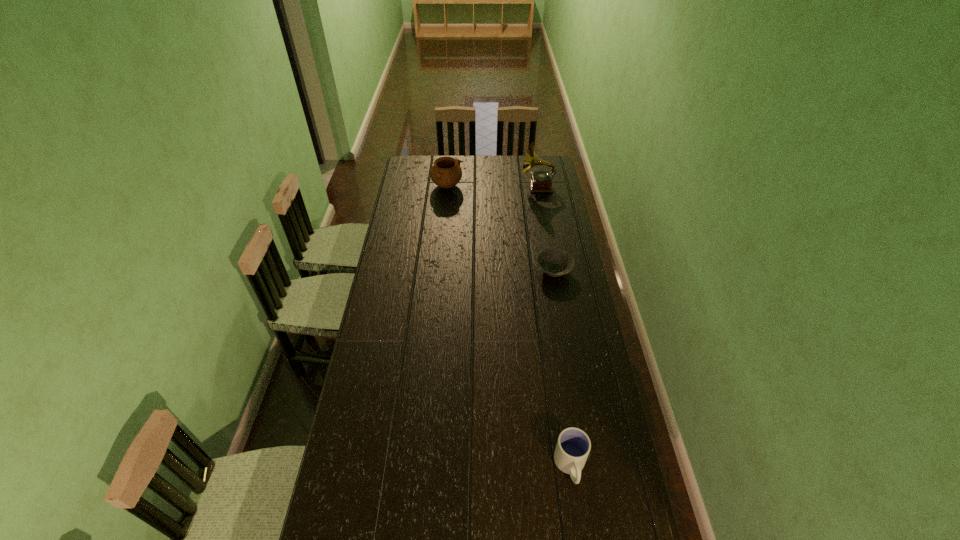
Locate an element on the screen. The width and height of the screenshot is (960, 540). the tallest object is located at coordinates (541, 181).

Locate an element on the screen. The height and width of the screenshot is (540, 960). pottery is located at coordinates pyautogui.click(x=446, y=172).

The width and height of the screenshot is (960, 540). Find the location of `the third shortest object`. the third shortest object is located at coordinates (446, 172).

Image resolution: width=960 pixels, height=540 pixels. I want to click on the nearest object, so click(x=573, y=446).

The image size is (960, 540). I want to click on cup, so click(573, 446).

You are a GUI agent. You are given a task and a screenshot of the screen. Output one action in this format:
    pyautogui.click(x=<x>, y=<y>)
    Task: Click on the bowl
    The width and height of the screenshot is (960, 540).
    Given the screenshot: What is the action you would take?
    pyautogui.click(x=555, y=262)

I want to click on the third farthest object, so click(555, 262).

At what (x,y) coordinates should I click in order to perform the action: click on free space located on the horn of the tallest object. Please return your answer as a coordinate pair (x, y). The image size is (960, 540). Looking at the image, I should click on (511, 186).

The image size is (960, 540). I want to click on free space located 0.340m on the horn of the tallest object, so click(462, 186).

Locate an element on the screen. This screenshot has height=540, width=960. vacant region located 0.110m on the horn of the tallest object is located at coordinates (502, 186).